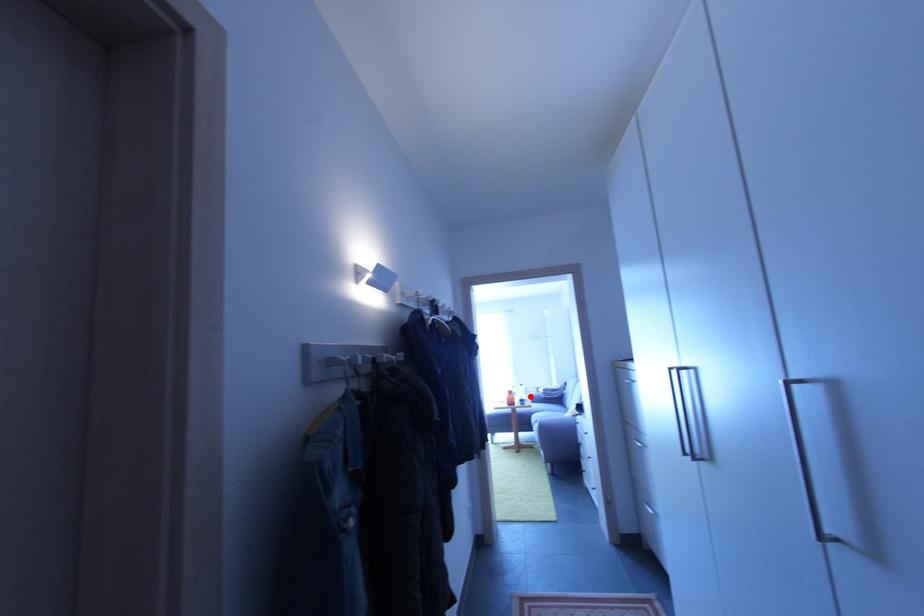
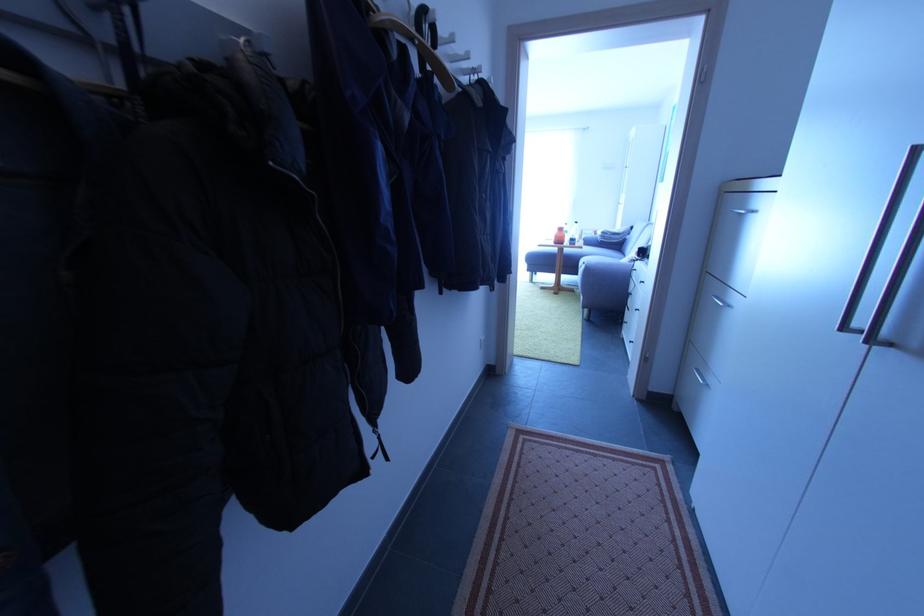
Where in the second image is the point corresponding to the highlighted location from the first image?

(585, 238)